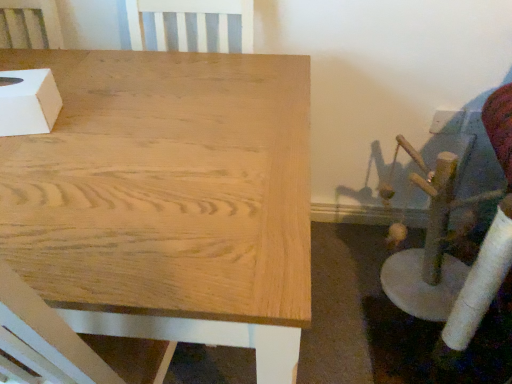
In the scene shown: Measure the distance between white matte tissue box at upper left and camera.

31.72 inches.

What are the coordinates of `white matte tissue box at upper left` in the screenshot? It's located at (28, 102).

What do you see at coordinates (28, 102) in the screenshot? The image size is (512, 384). I see `white matte tissue box at upper left` at bounding box center [28, 102].

What do you see at coordinates (168, 199) in the screenshot?
I see `natural wood table at center` at bounding box center [168, 199].

Locate an element on the screen. natural wood table at center is located at coordinates (168, 199).

Locate an element on the screen. This screenshot has height=384, width=512. white matte tissue box at upper left is located at coordinates (28, 102).

Between white matte tissue box at upper left and natural wood table at center, which one appears on the left side from the viewer's perspective?

Positioned to the left is white matte tissue box at upper left.

Which object is closer to the camera, white matte tissue box at upper left or natural wood table at center?

natural wood table at center is closer to the camera.

Does point (50, 94) lie in front of point (232, 121)?

No, it is behind (232, 121).

Consider the image. From the image's perspective, does white matte tissue box at upper left appear higher than natural wood table at center?

Yes, from the image's perspective, white matte tissue box at upper left is on top of natural wood table at center.

From a real-world perspective, which object rests below the other?

natural wood table at center.

Considering the sizes of objects white matte tissue box at upper left and natural wood table at center in the image provided, who is wider, white matte tissue box at upper left or natural wood table at center?

natural wood table at center is wider.

Considering the relative sizes of white matte tissue box at upper left and natural wood table at center in the image provided, is white matte tissue box at upper left taller than natural wood table at center?

In fact, white matte tissue box at upper left may be shorter than natural wood table at center.

Considering the relative sizes of white matte tissue box at upper left and natural wood table at center in the image provided, is white matte tissue box at upper left smaller than natural wood table at center?

Yes.

Does white matte tissue box at upper left contain natural wood table at center?

No, natural wood table at center is located outside of white matte tissue box at upper left.

In the scene shown: Can you see white matte tissue box at upper left touching natural wood table at center?

No, white matte tissue box at upper left is not making contact with natural wood table at center.

Based on the photo, is white matte tissue box at upper left positioned with its back to natural wood table at center?

No, white matte tissue box at upper left is not facing away from natural wood table at center.

Identify the location of box above the natural wood table at center (from a real-world perspective). [x=28, y=102].

Considering the positions of objects natural wood table at center and white matte tissue box at upper left in the image provided, who is more to the left, natural wood table at center or white matte tissue box at upper left?

white matte tissue box at upper left is more to the left.

Considering their positions, is natural wood table at center located in front of or behind white matte tissue box at upper left?

Clearly, natural wood table at center is in front of white matte tissue box at upper left.

Does point (296, 131) lie behind point (35, 94)?

Yes, it is behind point (35, 94).

From the image's perspective, is natural wood table at center beneath white matte tissue box at upper left?

Correct, natural wood table at center appears lower than white matte tissue box at upper left in the image.

From a real-world perspective, is natural wood table at center positioned above or below white matte tissue box at upper left?

In terms of real-world spatial position, natural wood table at center is below white matte tissue box at upper left.

Is natural wood table at center thinner than white matte tissue box at upper left?

No, natural wood table at center is not thinner than white matte tissue box at upper left.

Considering the sizes of objects natural wood table at center and white matte tissue box at upper left in the image provided, who is taller, natural wood table at center or white matte tissue box at upper left?

natural wood table at center is taller.

Does natural wood table at center have a smaller size compared to white matte tissue box at upper left?

No, natural wood table at center is not smaller than white matte tissue box at upper left.

Choose the correct answer: Is natural wood table at center inside white matte tissue box at upper left or outside it?

natural wood table at center is not enclosed by white matte tissue box at upper left.

Would you say natural wood table at center is a long distance from white matte tissue box at upper left?

No, natural wood table at center is not far from white matte tissue box at upper left.

Is white matte tissue box at upper left at the back of natural wood table at center?

No, natural wood table at center is not facing away from white matte tissue box at upper left.

Find the location of `box on the left of natural wood table at center`. box on the left of natural wood table at center is located at coordinates (28, 102).

Find the location of a particular element. Image resolution: width=512 pixels, height=384 pixels. box on the left of the natural wood table at center is located at coordinates (28, 102).

Locate an element on the screen. The width and height of the screenshot is (512, 384). box that appears above the natural wood table at center (from a real-world perspective) is located at coordinates (28, 102).